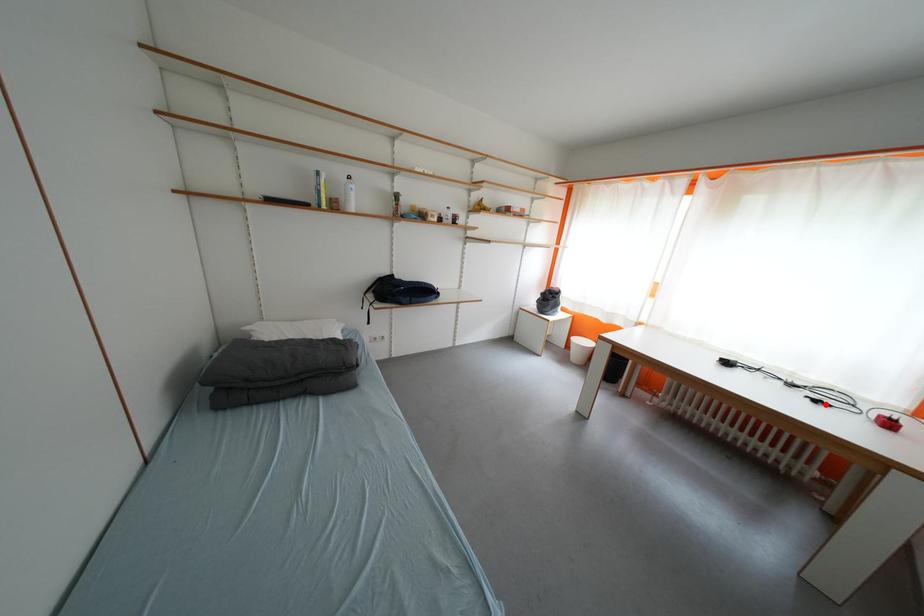
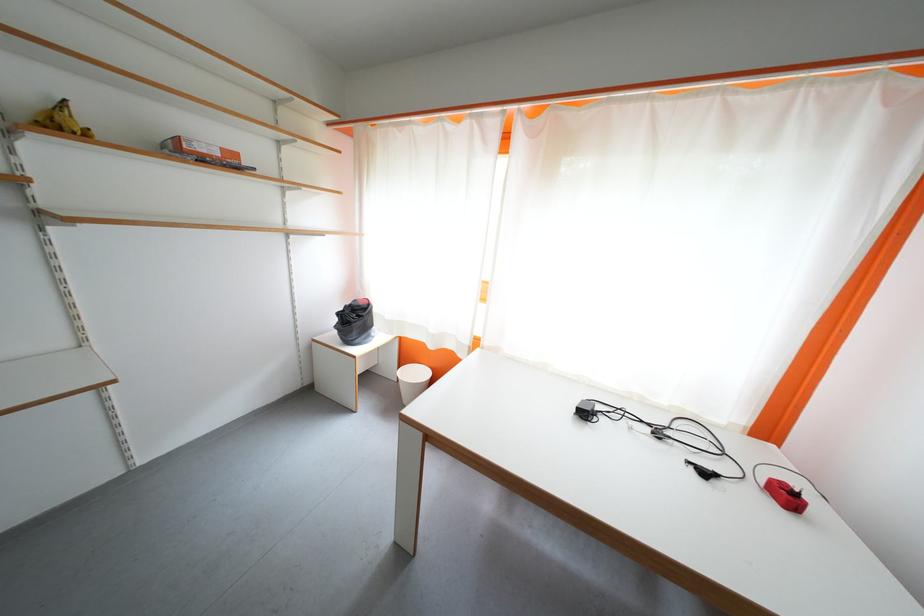
Locate, in the second image, the point that corresponds to the highlighted location in the first image.

(713, 477)